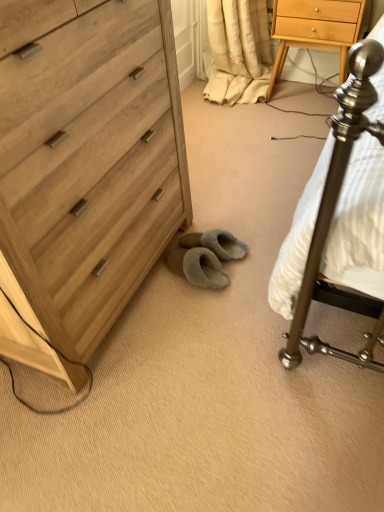
Question: Considering the positions of light wood/finish nightstand at upper right and light wood chest of drawers at left in the image, is light wood/finish nightstand at upper right taller or shorter than light wood chest of drawers at left?

Choices:
 (A) short
 (B) tall

Answer: (A)

Question: Does point (289, 25) appear closer or farther from the camera than point (23, 71)?

Choices:
 (A) farther
 (B) closer

Answer: (A)

Question: Based on their sizes in the image, would you say light wood/finish nightstand at upper right is bigger or smaller than light wood chest of drawers at left?

Choices:
 (A) big
 (B) small

Answer: (B)

Question: Is point (87, 188) positioned closer to the camera than point (306, 18)?

Choices:
 (A) farther
 (B) closer

Answer: (B)

Question: Would you say light wood chest of drawers at left is to the left or to the right of light wood/finish nightstand at upper right in the picture?

Choices:
 (A) left
 (B) right

Answer: (A)

Question: Relative to light wood/finish nightstand at upper right, is light wood chest of drawers at left in front or behind?

Choices:
 (A) behind
 (B) front

Answer: (B)

Question: Based on their sizes in the image, would you say light wood chest of drawers at left is bigger or smaller than light wood/finish nightstand at upper right?

Choices:
 (A) big
 (B) small

Answer: (A)